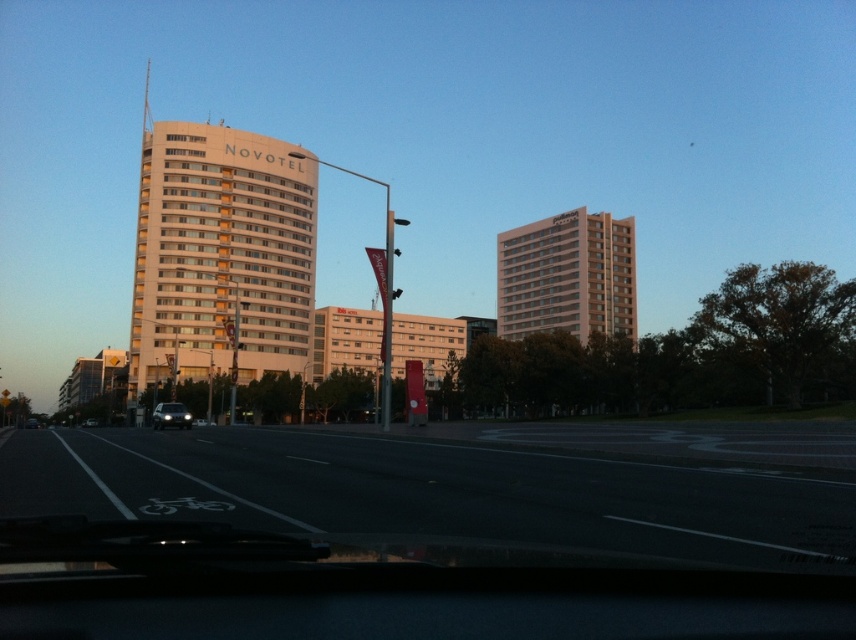
You are standing at the point marked as point (183, 424) in the cityscape image. You want to walk towards the NOVOTEL building. Given that the distance between you and the viewer is 159.96 feet, can you estimate how far you are from the NOVOTEL building?

The distance between point (183, 424) and the viewer is 159.96 feet. Since the NOVOTEL building is visible in the midground of the scene, it is likely located closer to the viewer than the background elements. However, without specific information about the exact position of the NOVOTEL relative to the point, we cannot precisely determine the distance from the point to the building. The given distance is from the point to the viewer, not directly to the NOVOTEL.

You are a drone operator trying to locate the white smooth building at center. According to the scene description, where would you find it?

The white smooth building at center is located at point 2D coordinates of (221,256).